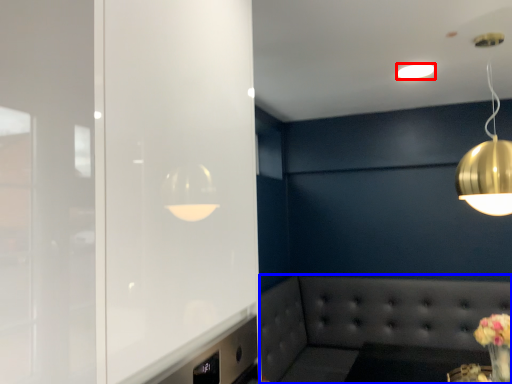
Question: Which of the following is the closest to the observer, lamp (highlighted by a red box) or couch (highlighted by a blue box)?

Choices:
 (A) lamp
 (B) couch

Answer: (A)